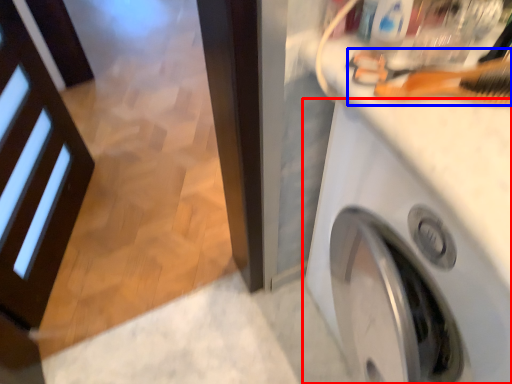
Question: Which object is further to the camera taking this photo, washing machine (highlighted by a red box) or brush (highlighted by a blue box)?

Choices:
 (A) washing machine
 (B) brush

Answer: (B)